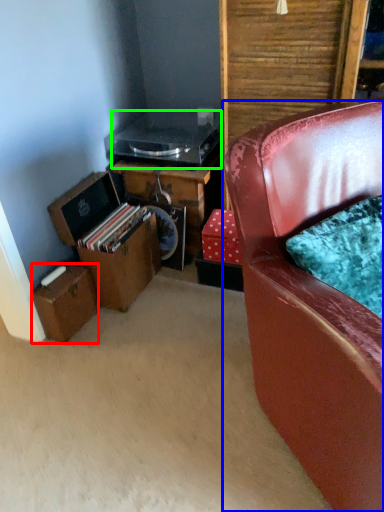
Question: Estimate the real-world distances between objects in this image. Which object is farther from box (highlighted by a red box), chair (highlighted by a blue box) or appliance (highlighted by a green box)?

Choices:
 (A) chair
 (B) appliance

Answer: (A)